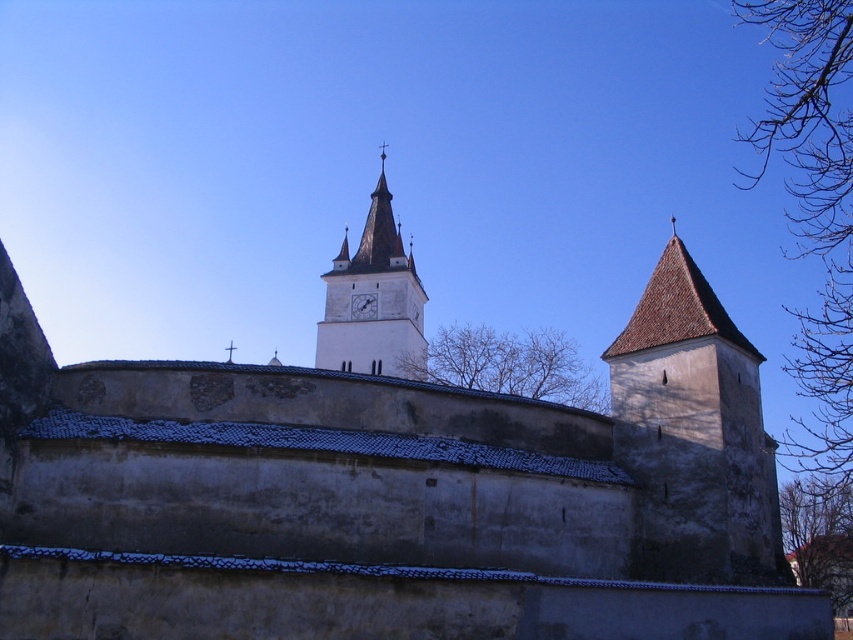
Does brown stone tower at right have a greater width compared to white stone clock tower at center?

Incorrect, brown stone tower at right's width does not surpass white stone clock tower at center's.

Does brown stone tower at right appear on the left side of white stone clock tower at center?

Incorrect, brown stone tower at right is not on the left side of white stone clock tower at center.

Is point (724, 566) more distant than point (321, 349)?

No, it is not.

I want to click on brown stone tower at right, so click(694, 435).

Is point (366, 355) more distant than point (358, 296)?

No.

Does white stone clock tower at center lie in front of white glossy clock at center?

Yes, white stone clock tower at center is closer to the viewer.

Does point (381, 163) lie in front of point (358, 317)?

No, it is not.

The height and width of the screenshot is (640, 853). What are the coordinates of `white stone clock tower at center` in the screenshot? It's located at (376, 300).

Between brown stone tower at right and white glossy clock at center, which one has less height?

Standing shorter between the two is white glossy clock at center.

Does brown stone tower at right come behind white glossy clock at center?

No, it is in front of white glossy clock at center.

Who is more distant from viewer, (688, 573) or (370, 307)?

The point (370, 307) is more distant.

Find the location of `brown stone tower at right`. brown stone tower at right is located at coordinates (694, 435).